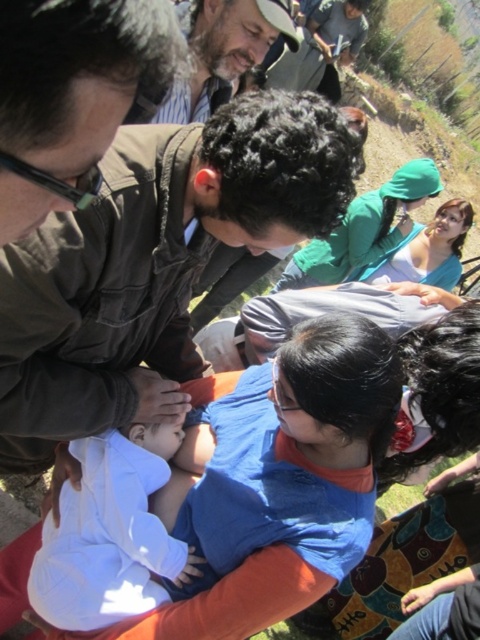
Who is positioned more to the left, brown leather jacket at center or brown leather hat at upper center?

Positioned to the left is brown leather jacket at center.

You are a GUI agent. You are given a task and a screenshot of the screen. Output one action in this format:
    pyautogui.click(x=<x>, y=<y>)
    Task: Click on the brown leather jacket at center
    The height and width of the screenshot is (640, 480).
    Given the screenshot: What is the action you would take?
    pyautogui.click(x=153, y=260)

Between point (104, 209) and point (186, 81), which one is positioned behind?

The point (186, 81) is more distant.

Locate an element on the screen. The height and width of the screenshot is (640, 480). brown leather jacket at center is located at coordinates (153, 260).

Does brown leather jacket at center appear on the right side of white soft baby at center?

No, brown leather jacket at center is not to the right of white soft baby at center.

Does point (189, 360) lie in front of point (190, 573)?

No, (189, 360) is further to viewer.

I want to click on brown leather jacket at center, so click(x=153, y=260).

Based on the photo, is white soft baby at center wider than brown leather hat at upper center?

No.

Is white soft baby at center in front of brown leather hat at upper center?

Yes.

Is point (79, 497) positioned in front of point (264, 16)?

Yes, it is.

Where is `white soft baby at center`? The width and height of the screenshot is (480, 640). white soft baby at center is located at coordinates point(110,532).